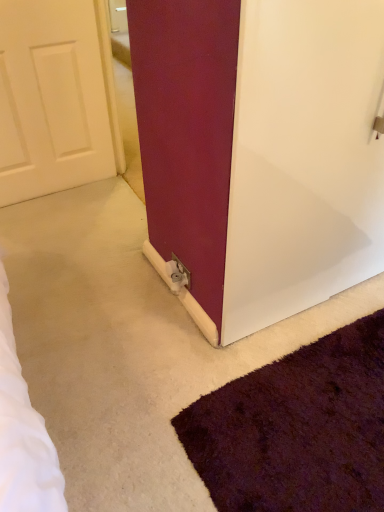
Question: Considering the relative positions of metallic silver outlet at lower center and matte white door at center in the image provided, is metallic silver outlet at lower center to the left or to the right of matte white door at center?

Choices:
 (A) right
 (B) left

Answer: (B)

Question: Is point (188, 275) positioned closer to the camera than point (230, 153)?

Choices:
 (A) closer
 (B) farther

Answer: (B)

Question: Choose the correct answer: Is metallic silver outlet at lower center inside matte white door at center or outside it?

Choices:
 (A) inside
 (B) outside

Answer: (B)

Question: From a real-world perspective, is matte white door at center physically located above or below metallic silver outlet at lower center?

Choices:
 (A) above
 (B) below

Answer: (A)

Question: Do you think matte white door at center is within metallic silver outlet at lower center, or outside of it?

Choices:
 (A) inside
 (B) outside

Answer: (B)

Question: Considering the positions of matte white door at center and metallic silver outlet at lower center in the image, is matte white door at center taller or shorter than metallic silver outlet at lower center?

Choices:
 (A) short
 (B) tall

Answer: (B)

Question: Is matte white door at center wider or thinner than metallic silver outlet at lower center?

Choices:
 (A) thin
 (B) wide

Answer: (B)